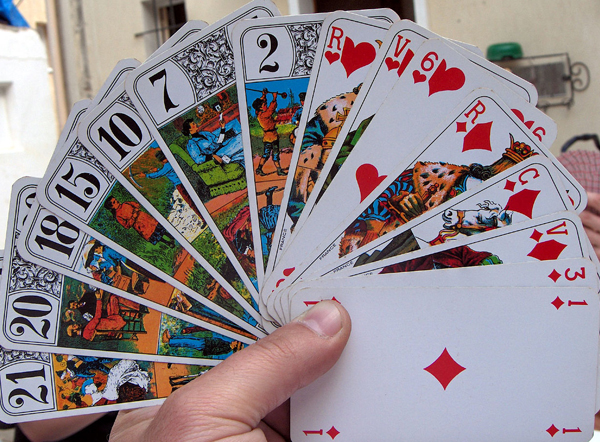
I want to click on doorway, so click(x=352, y=3).